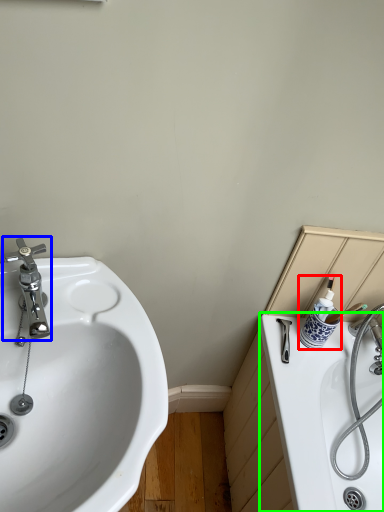
Question: Which object is positioned closest to toiletry (highlighted by a red box)? Select from tap (highlighted by a blue box) and bath (highlighted by a green box).

Choices:
 (A) tap
 (B) bath

Answer: (B)